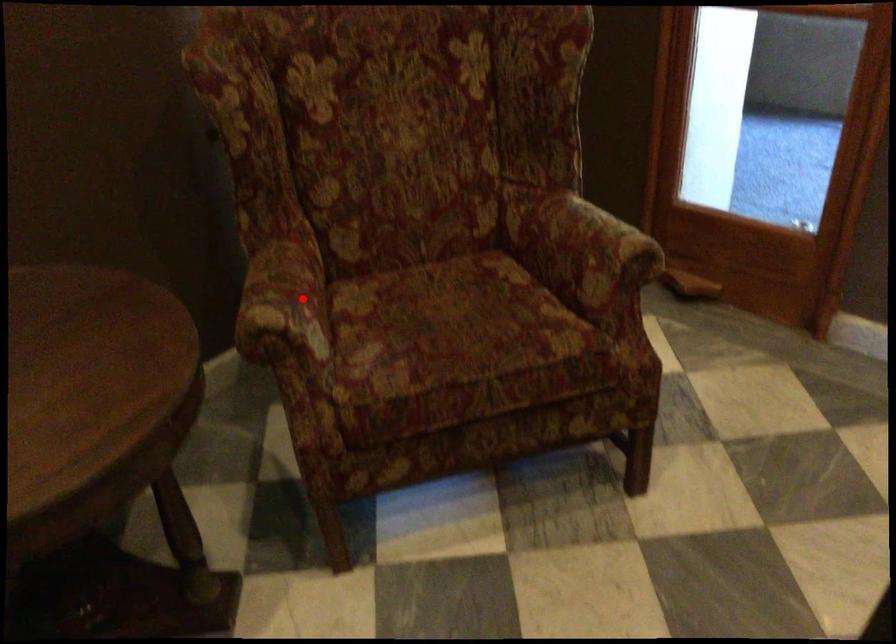
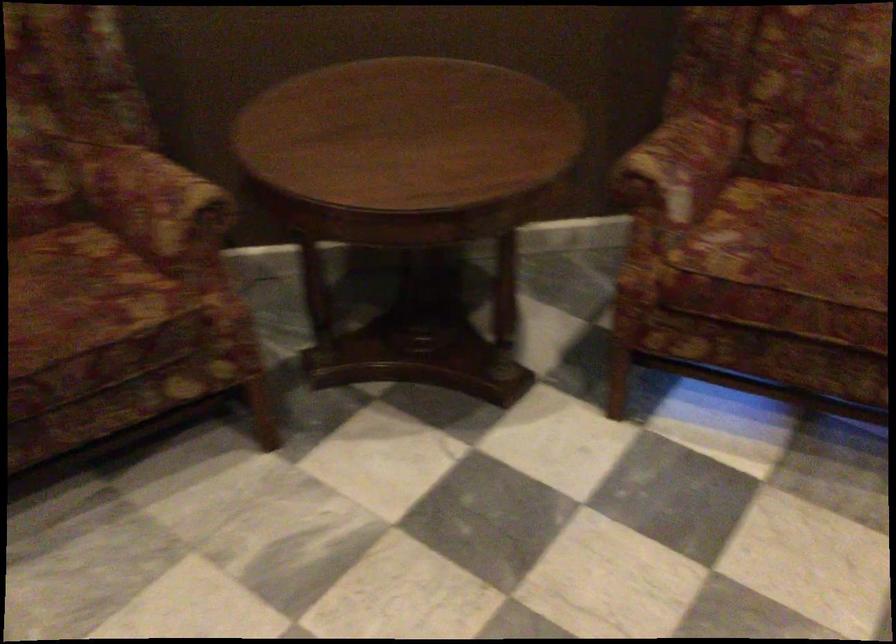
Locate, in the second image, the point that corresponds to the highlighted location in the first image.

(679, 164)